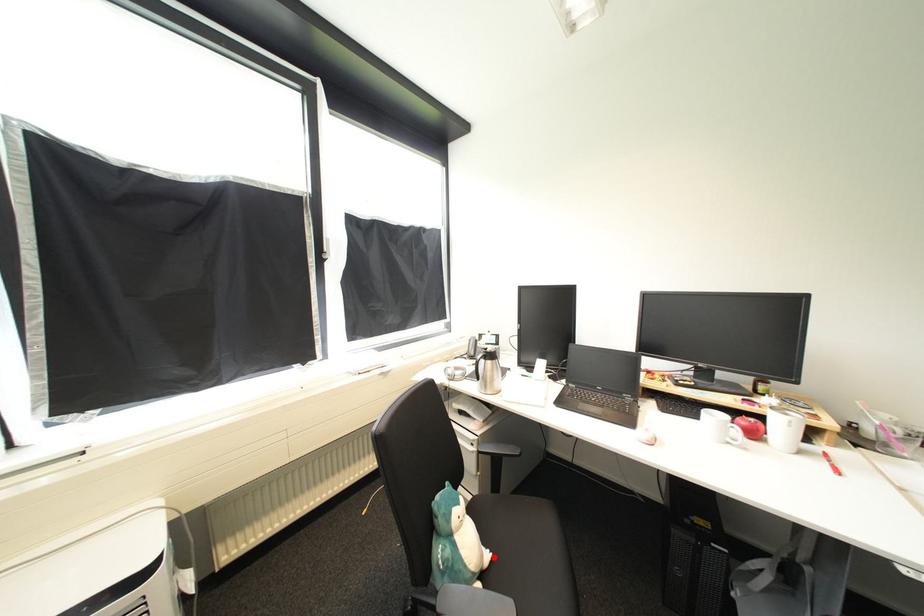
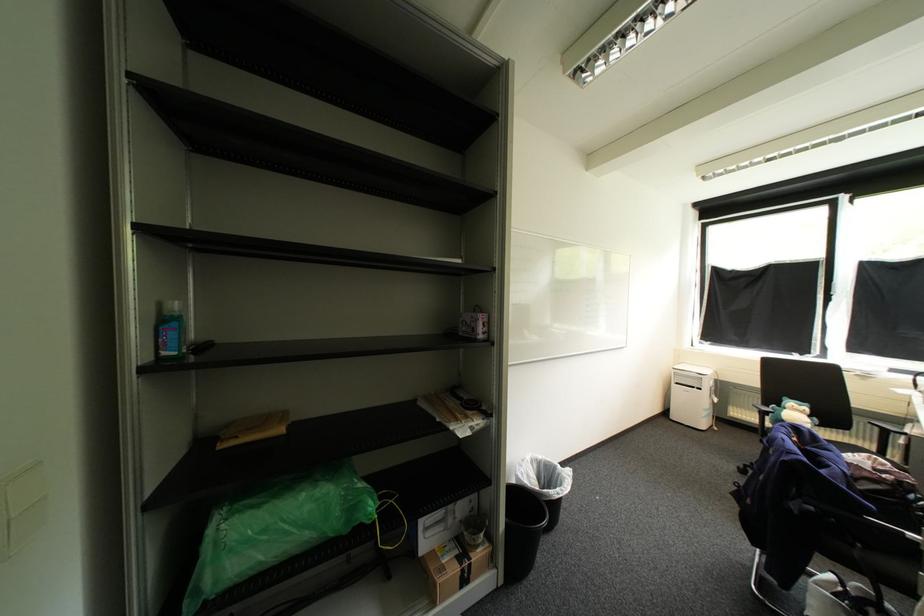
Where in the second image is the point corresponding to the highlighted location from the first image?

(813, 436)